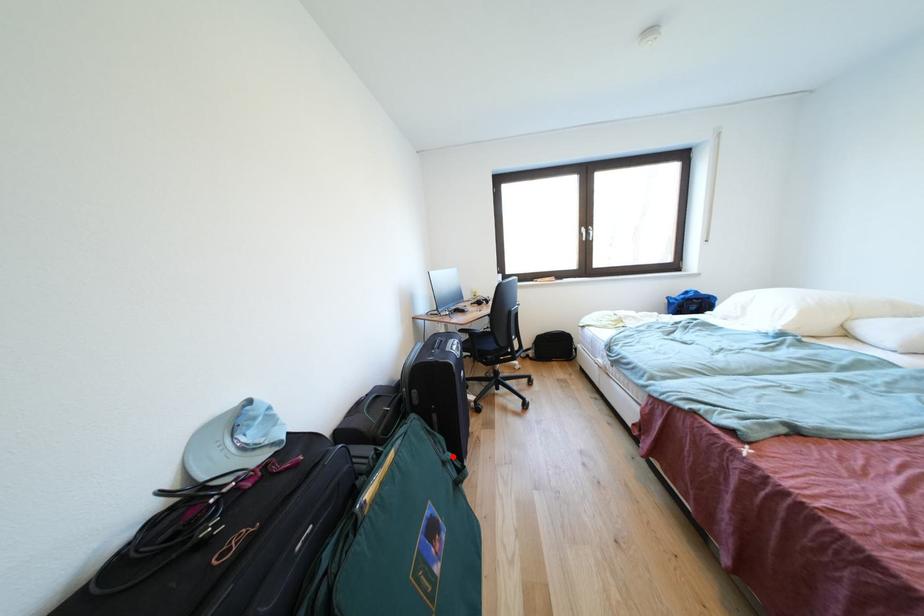
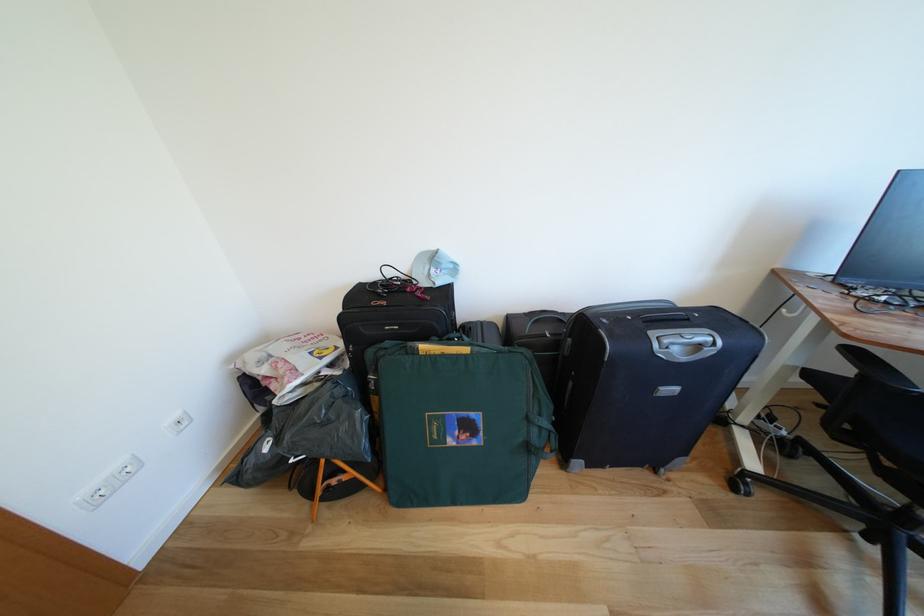
The point at the highlighted location is marked in the first image. Where is the corresponding point in the second image?

(548, 419)